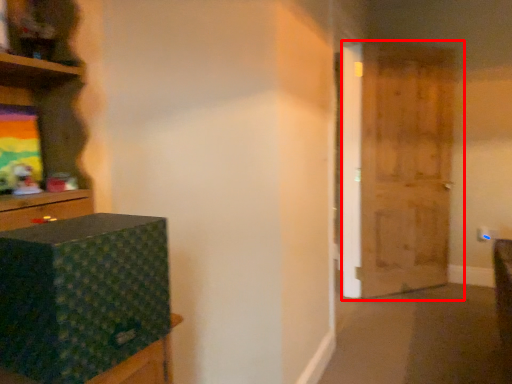
Question: From the image's perspective, where is door (annotated by the red box) located in relation to box in the image?

Choices:
 (A) above
 (B) below

Answer: (A)